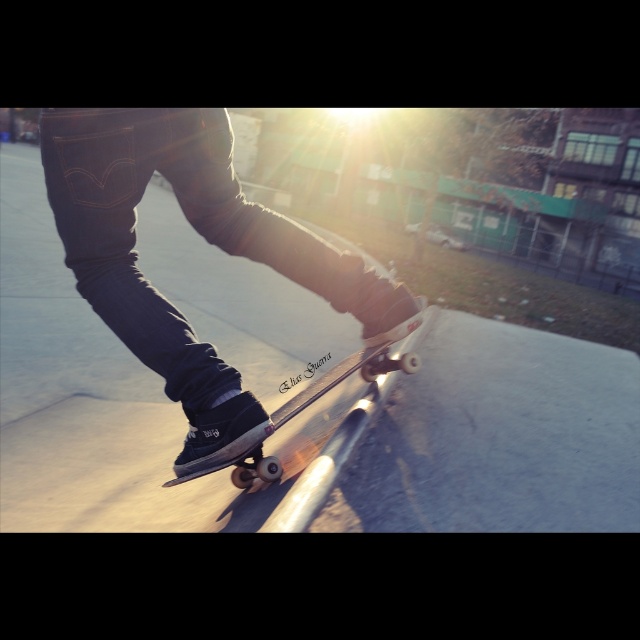
You are a photographer trying to capture the skateboarder. You need to know if the matte black skateboarding shoe at center will block the view of the wooden skateboard at center in your shot. Can you determine this based on their widths?

The matte black skateboarding shoe at center might be wider than wooden skateboard at center, so there is a possibility that the shoe could block the skateboard in the photo.

You are a photographer trying to capture the skateboarder midair. You notice the matte black skateboarding shoe at center and the wooden skateboard at center. Which object appears larger in your camera frame?

The matte black skateboarding shoe at center appears larger than the wooden skateboard at center because it is much taller as wooden skateboard at center.